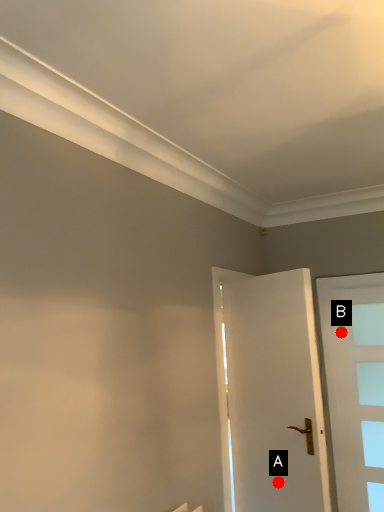
Question: Two points are circled on the image, labeled by A and B beside each circle. Which point is closer to the camera?

Choices:
 (A) A is closer
 (B) B is closer

Answer: (A)